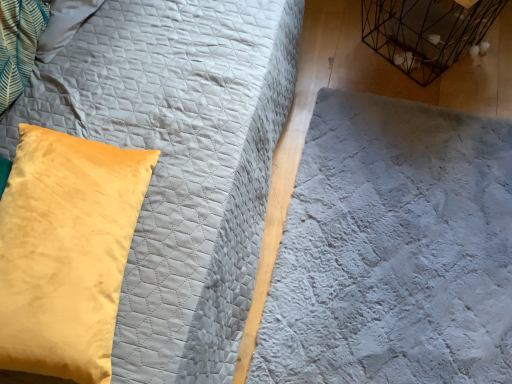
Question: In terms of width, does velvet yellow pillow at left look wider or thinner when compared to black wire birdcage at upper right?

Choices:
 (A) thin
 (B) wide

Answer: (B)

Question: Is velvet yellow pillow at left to the left or to the right of black wire birdcage at upper right in the image?

Choices:
 (A) left
 (B) right

Answer: (A)

Question: Estimate the real-world distances between objects in this image. Which object is farther from the velvet yellow pillow at left?

Choices:
 (A) white quilted fabric at center
 (B) black wire birdcage at upper right

Answer: (B)

Question: Which object is positioned farthest from the white quilted fabric at center?

Choices:
 (A) black wire birdcage at upper right
 (B) velvet yellow pillow at left

Answer: (B)